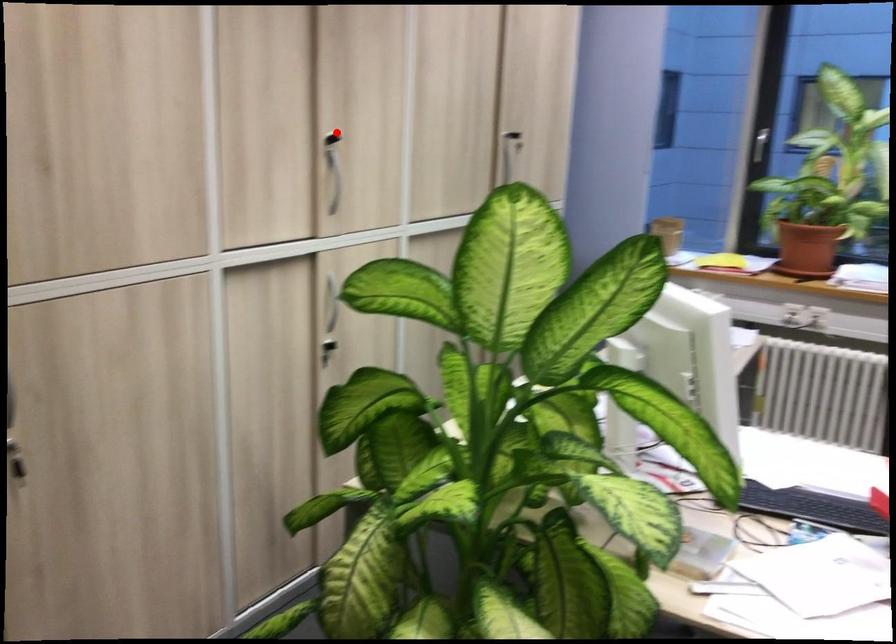
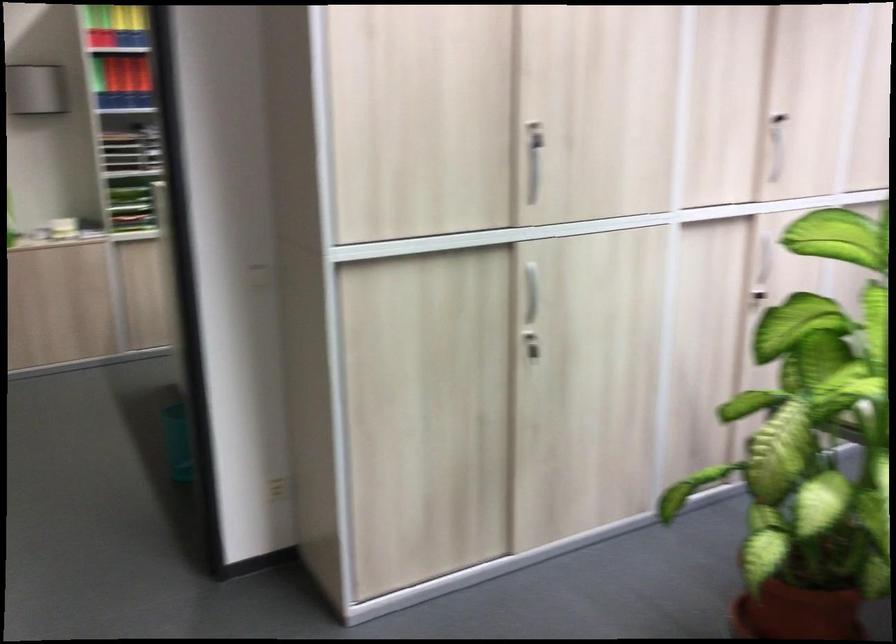
Question: I am providing you with two images of the same scene from different viewpoints. Given a red point in image1, look at the same physical point in image2. Is it:

Choices:
 (A) Closer to the viewpoint
 (B) Farther from the viewpoint

Answer: (B)